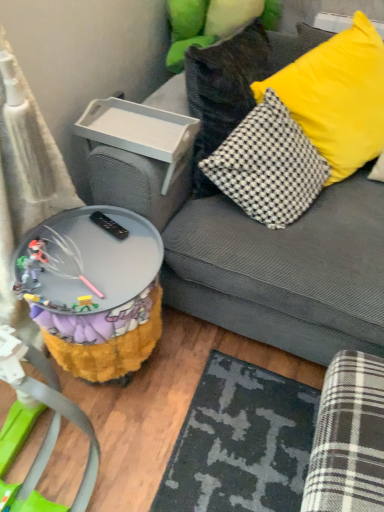
I want to click on fuzzy fabric table at lower left, so click(95, 289).

This screenshot has width=384, height=512. What are the coordinates of `yellow fabric pillow at upper right` in the screenshot? It's located at (337, 97).

At what (x,y) coordinates should I click in order to perform the action: click on gray fabric couch at upper right. Please return your answer as a coordinate pair (x, y). The width and height of the screenshot is (384, 512). Looking at the image, I should click on (285, 271).

From the image's perspective, between gray fabric couch at upper right and white plastic tray at upper left, which one is located above?

white plastic tray at upper left appears higher in the image.

Is gray fabric couch at upper right bigger than white plastic tray at upper left?

Yes, gray fabric couch at upper right is bigger than white plastic tray at upper left.

Is gray fabric couch at upper right surrounding white plastic tray at upper left?

That's correct, white plastic tray at upper left is inside gray fabric couch at upper right.

Can you see gray fabric couch at upper right touching white plastic tray at upper left?

gray fabric couch at upper right and white plastic tray at upper left are clearly separated.

Is yellow fabric pillow at upper right positioned far away from fuzzy fabric table at lower left?

No.

Which of these two, yellow fabric pillow at upper right or fuzzy fabric table at lower left, is smaller?

With smaller size is fuzzy fabric table at lower left.

In the scene shown: From a real-world perspective, relative to fuzzy fabric table at lower left, is yellow fabric pillow at upper right vertically above or below?

yellow fabric pillow at upper right is situated higher than fuzzy fabric table at lower left in the real world.

Based on the photo, is yellow fabric pillow at upper right turned away from fuzzy fabric table at lower left?

No, fuzzy fabric table at lower left is not at the back of yellow fabric pillow at upper right.

Is the depth of fuzzy fabric table at lower left less than that of yellow fabric pillow at upper right?

No, the depth of fuzzy fabric table at lower left is greater than that of yellow fabric pillow at upper right.

Choose the correct answer: Is fuzzy fabric table at lower left inside yellow fabric pillow at upper right or outside it?

fuzzy fabric table at lower left cannot be found inside yellow fabric pillow at upper right.

Looking at this image, from a real-world perspective, which object rests below the other?

In real-world perspective, fuzzy fabric table at lower left is lower.

Could you tell me if fuzzy fabric table at lower left is turned towards yellow fabric pillow at upper right?

No, fuzzy fabric table at lower left is not oriented towards yellow fabric pillow at upper right.

In the scene shown: Is fuzzy fabric table at lower left closer to camera compared to white plastic tray at upper left?

Yes, fuzzy fabric table at lower left is in front of white plastic tray at upper left.

Looking at this image, is fuzzy fabric table at lower left completely or partially outside of white plastic tray at upper left?

fuzzy fabric table at lower left lies outside white plastic tray at upper left's area.

Would you consider fuzzy fabric table at lower left to be distant from white plastic tray at upper left?

No, fuzzy fabric table at lower left is not far from white plastic tray at upper left.

What's the angular difference between fuzzy fabric table at lower left and white plastic tray at upper left's facing directions?

fuzzy fabric table at lower left and white plastic tray at upper left are facing 1.03 degrees away from each other.

From a real-world perspective, which object rests below the other?

white plastic tray at upper left.

From the image's perspective, which is below, yellow fabric pillow at upper right or white plastic tray at upper left?

white plastic tray at upper left appears lower in the image.

Considering the sizes of objects yellow fabric pillow at upper right and white plastic tray at upper left in the image provided, who is shorter, yellow fabric pillow at upper right or white plastic tray at upper left?

white plastic tray at upper left.

Is gray fabric couch at upper right turned away from yellow fabric pillow at upper right?

That's right, gray fabric couch at upper right is facing away from yellow fabric pillow at upper right.

Based on their positions, is gray fabric couch at upper right located to the left or right of yellow fabric pillow at upper right?

Clearly, gray fabric couch at upper right is on the left of yellow fabric pillow at upper right in the image.

This screenshot has width=384, height=512. Identify the location of pillow that is on the right side of gray fabric couch at upper right. (337, 97).

From the image's perspective, is yellow fabric pillow at upper right located above gray fabric couch at upper right?

Yes, from the image's perspective, yellow fabric pillow at upper right is on top of gray fabric couch at upper right.

Would you say yellow fabric pillow at upper right contains gray fabric couch at upper right?

No, gray fabric couch at upper right is not a part of yellow fabric pillow at upper right.

Is yellow fabric pillow at upper right wider or thinner than gray fabric couch at upper right?

Clearly, yellow fabric pillow at upper right has less width compared to gray fabric couch at upper right.

Is yellow fabric pillow at upper right bigger than gray fabric couch at upper right?

No.

Find the location of `studio couch below the white plastic tray at upper left (from the image's perspective)`. studio couch below the white plastic tray at upper left (from the image's perspective) is located at coordinates (285, 271).

At what (x,y) coordinates should I click in order to perform the action: click on pillow in front of the fuzzy fabric table at lower left. Please return your answer as a coordinate pair (x, y). The width and height of the screenshot is (384, 512). Looking at the image, I should click on (337, 97).

Which object lies nearer to the anchor point white plastic tray at upper left, yellow fabric pillow at upper right or gray fabric couch at upper right?

gray fabric couch at upper right lies closer to white plastic tray at upper left than the other object.

Estimate the real-world distances between objects in this image. Which object is closer to gray fabric couch at upper right, yellow fabric pillow at upper right or white plastic tray at upper left?

Among the two, yellow fabric pillow at upper right is located nearer to gray fabric couch at upper right.

From the image, which object appears to be nearer to white plastic tray at upper left, gray fabric couch at upper right or yellow fabric pillow at upper right?

gray fabric couch at upper right is closer to white plastic tray at upper left.

From the picture: Which object lies further to the anchor point yellow fabric pillow at upper right, white plastic tray at upper left or gray fabric couch at upper right?

white plastic tray at upper left is positioned further to the anchor yellow fabric pillow at upper right.

Considering their positions, is gray fabric couch at upper right positioned closer to fuzzy fabric table at lower left than yellow fabric pillow at upper right?

gray fabric couch at upper right lies closer to fuzzy fabric table at lower left than the other object.

Based on their spatial positions, is gray fabric couch at upper right or white plastic tray at upper left further from fuzzy fabric table at lower left?

white plastic tray at upper left lies further to fuzzy fabric table at lower left than the other object.

From the picture: When comparing their distances from fuzzy fabric table at lower left, does yellow fabric pillow at upper right or gray fabric couch at upper right seem closer?

Based on the image, gray fabric couch at upper right appears to be nearer to fuzzy fabric table at lower left.

When comparing their distances from yellow fabric pillow at upper right, does fuzzy fabric table at lower left or gray fabric couch at upper right seem closer?

gray fabric couch at upper right.

Image resolution: width=384 pixels, height=512 pixels. Identify the location of storage box located between fuzzy fabric table at lower left and gray fabric couch at upper right in the left-right direction. (140, 132).

I want to click on storage box between fuzzy fabric table at lower left and yellow fabric pillow at upper right from left to right, so click(x=140, y=132).

Locate an element on the screen. The width and height of the screenshot is (384, 512). studio couch between fuzzy fabric table at lower left and yellow fabric pillow at upper right is located at coordinates (285, 271).

You are a GUI agent. You are given a task and a screenshot of the screen. Output one action in this format:
    pyautogui.click(x=<x>, y=<y>)
    Task: Click on the studio couch located between white plastic tray at upper left and yellow fabric pillow at upper right in the left-right direction
    
    Given the screenshot: What is the action you would take?
    pyautogui.click(x=285, y=271)